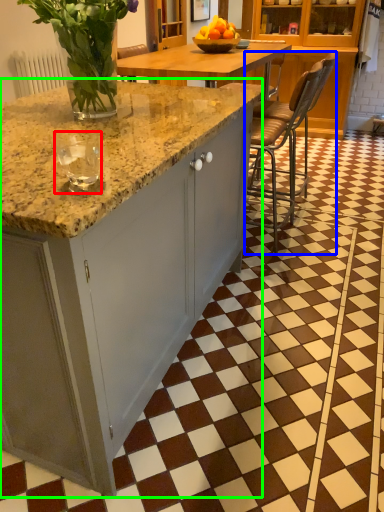
Question: Which object is the farthest from wine glass (highlighted by a red box)? Choose among these: chair (highlighted by a blue box) or cabinetry (highlighted by a green box).

Choices:
 (A) chair
 (B) cabinetry

Answer: (A)